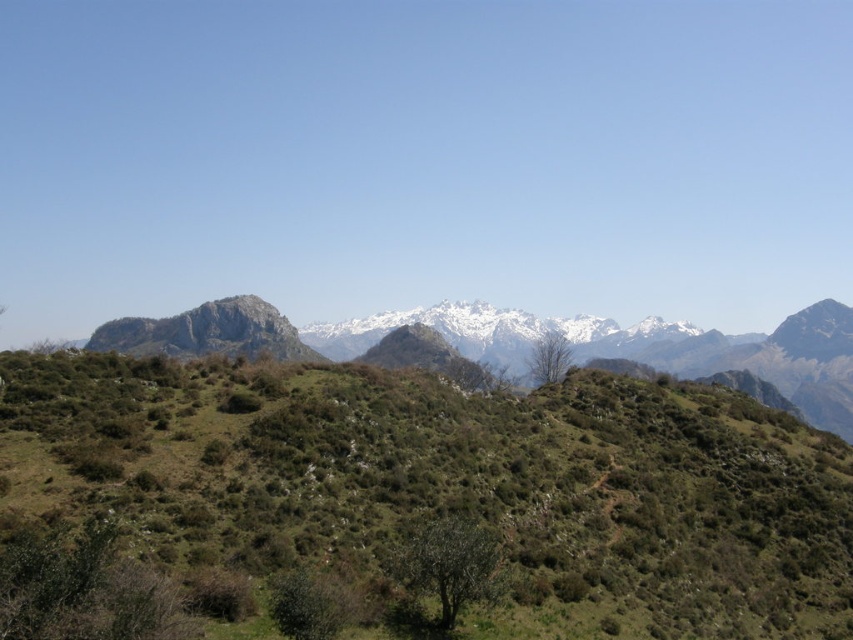
You are standing at the point marked by the coordinate point at point [641,348]. Looking around, you see the rugged stone mountain range at center. Which direction should you face to see the rugged stone mountain range at center?

Since you are standing at the point marked by the coordinate point [641,348], which represents the rugged stone mountain range at center, you are already at the location of the rugged stone mountain range at center. Therefore, you would not need to face any particular direction to see it as you are already there.

You are a hiker planning to traverse the mountain landscape. You notice the green grassy hill at center. Based on its position, which direction should you head to reach it from your current location at point A?

The green grassy hill at center is located at point (451, 484), so you should head towards the coordinates provided to reach it from point A.